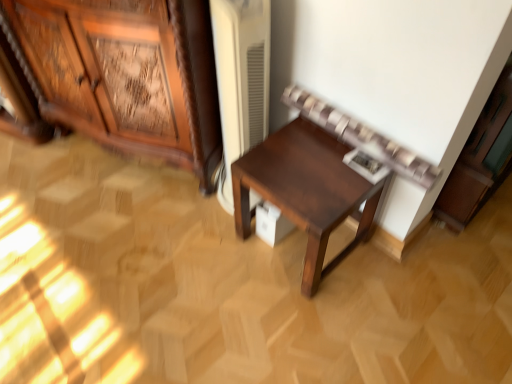
What are the coordinates of `spots to the right of dark wood table at center` in the screenshot? It's located at (403, 273).